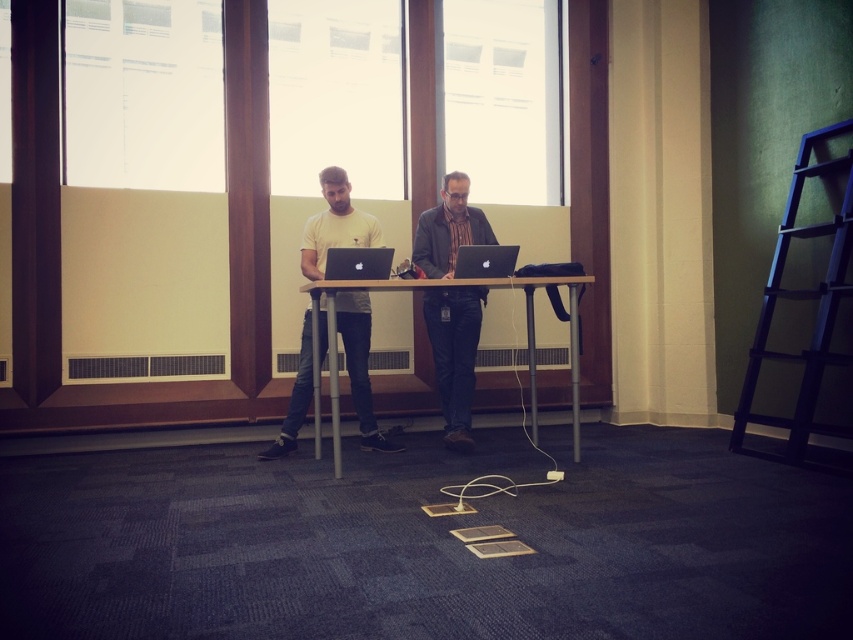
Does matte black jacket at center have a greater width compared to glossy black laptop at center?

Yes, matte black jacket at center is wider than glossy black laptop at center.

The width and height of the screenshot is (853, 640). What do you see at coordinates (454, 355) in the screenshot? I see `matte black jacket at center` at bounding box center [454, 355].

You are a GUI agent. You are given a task and a screenshot of the screen. Output one action in this format:
    pyautogui.click(x=<x>, y=<y>)
    Task: Click on the matte black jacket at center
    This screenshot has width=853, height=640.
    Given the screenshot: What is the action you would take?
    454,355

Can you confirm if matte yellow t-shirt at center is positioned to the right of glossy black laptop at center?

No, matte yellow t-shirt at center is not to the right of glossy black laptop at center.

Image resolution: width=853 pixels, height=640 pixels. What do you see at coordinates (335, 225) in the screenshot?
I see `matte yellow t-shirt at center` at bounding box center [335, 225].

Identify the location of matte yellow t-shirt at center. (335, 225).

Which of these two, dark blue wooden ladder at right or metallic silver table at center, stands shorter?

Standing shorter between the two is metallic silver table at center.

Is dark blue wooden ladder at right above metallic silver table at center?

Yes.

Is point (775, 358) closer to viewer compared to point (498, 285)?

That is False.

Find the location of a particular element. dark blue wooden ladder at right is located at coordinates (804, 300).